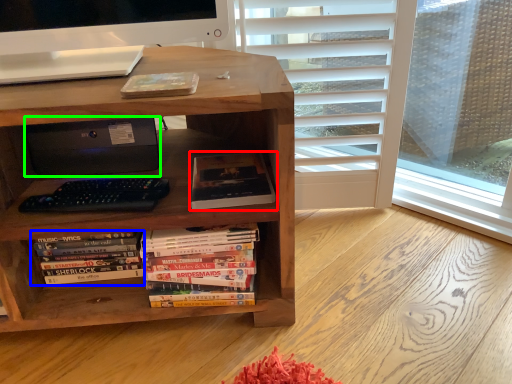
Question: Which object is positioned closest to book (highlighted by a red box)? Select from book (highlighted by a blue box) and printer (highlighted by a green box).

Choices:
 (A) book
 (B) printer

Answer: (B)